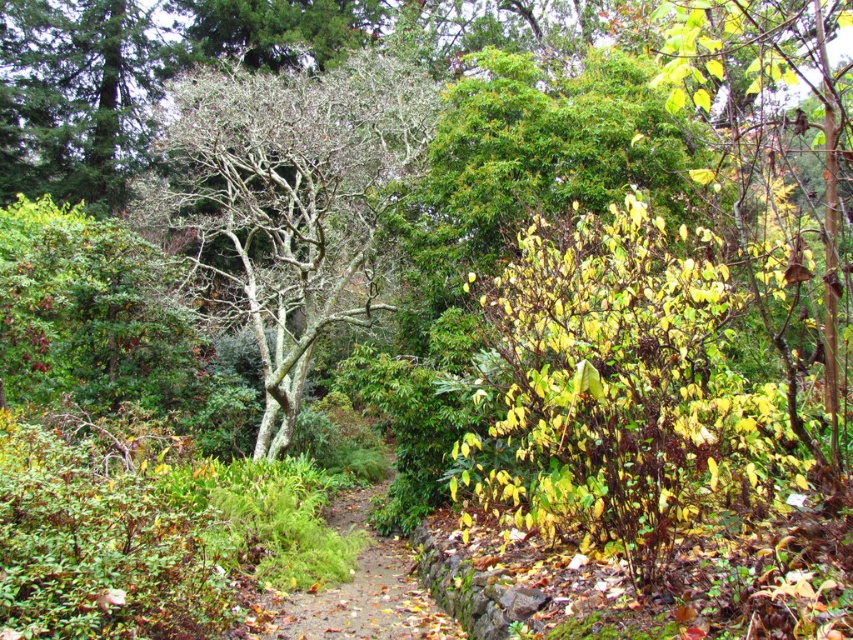
You are planning to walk along the brown dirt path at center while avoiding the white bark tree at center. Based on their widths, which one is wider and might require more caution to navigate around?

The white bark tree at center is wider than the brown dirt path at center, so you need to be cautious as the path might be narrower than the tree, requiring careful navigation to avoid collision.

You are standing at point (289, 200) in this autumn garden scene. What object is located exactly at your current position?

A white bark tree at center is located exactly at point (289, 200).

You are standing at the starting point of the dirt path in the autumn garden. You want to walk directly towards the white bark tree at center. Which direction should you head relative to the path?

Since the white bark tree at center is located at coordinates (289, 200), you should walk towards the center of the image along the dirt path to reach it.